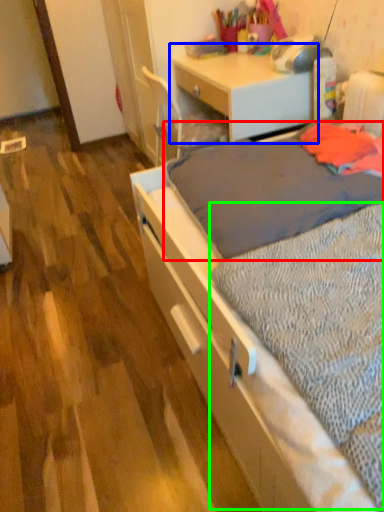
Question: Based on their relative distances, which object is farther from blanket (highlighted by a red box)? Choose from desk (highlighted by a blue box) and sheet (highlighted by a green box).

Choices:
 (A) desk
 (B) sheet

Answer: (A)